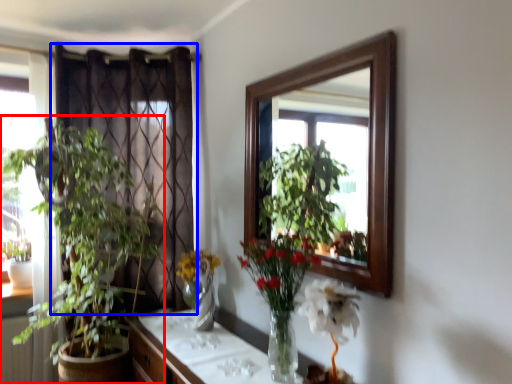
Question: Which of the following is the farthest to the observer, houseplant (highlighted by a red box) or curtain (highlighted by a blue box)?

Choices:
 (A) houseplant
 (B) curtain

Answer: (B)